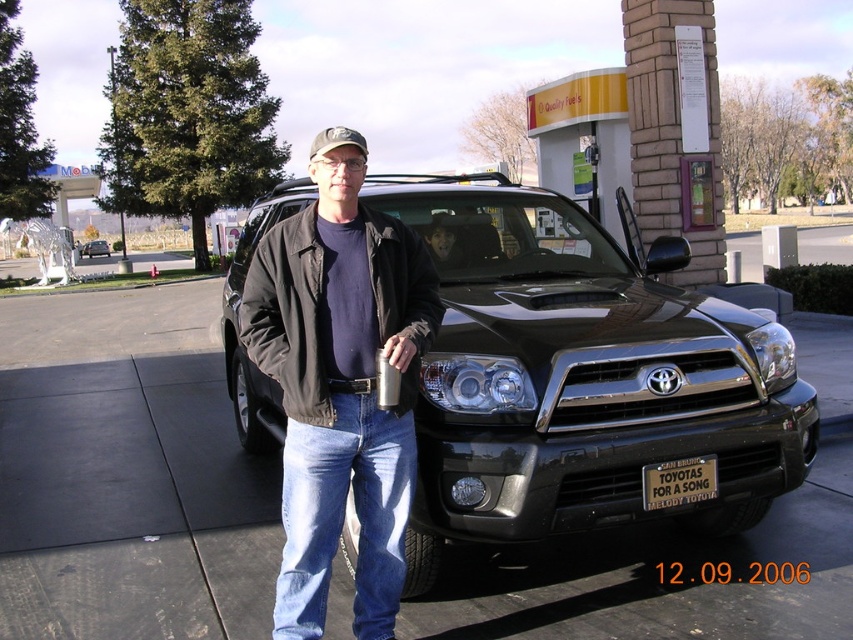
Is black metallic suv at center positioned behind camouflage fabric baseball cap at upper center?

Yes, black metallic suv at center is behind camouflage fabric baseball cap at upper center.

Does black metallic suv at center have a lesser width compared to camouflage fabric baseball cap at upper center?

Yes, black metallic suv at center is thinner than camouflage fabric baseball cap at upper center.

Which is in front, point (480, 481) or point (331, 132)?

Positioned in front is point (331, 132).

The image size is (853, 640). I want to click on black metallic suv at center, so (583, 378).

Can you confirm if black leather jacket at center is taller than black matte suv at center?

No, black leather jacket at center is not taller than black matte suv at center.

Is black leather jacket at center below black matte suv at center?

Yes, black leather jacket at center is below black matte suv at center.

Does point (251, 360) come farther from viewer compared to point (103, 244)?

No, it is in front of (103, 244).

This screenshot has width=853, height=640. In order to click on black leather jacket at center in this screenshot , I will do `click(340, 388)`.

Is point (643, 486) more distant than point (457, 250)?

No, (643, 486) is in front of (457, 250).

Between metallic silver license plate at front center and matte black face at center, which one appears on the right side from the viewer's perspective?

Positioned to the right is metallic silver license plate at front center.

Between point (654, 497) and point (450, 266), which one is positioned behind?

Point (450, 266)

At what (x,y) coordinates should I click in order to perform the action: click on metallic silver license plate at front center. Please return your answer as a coordinate pair (x, y). The image size is (853, 640). Looking at the image, I should click on (679, 483).